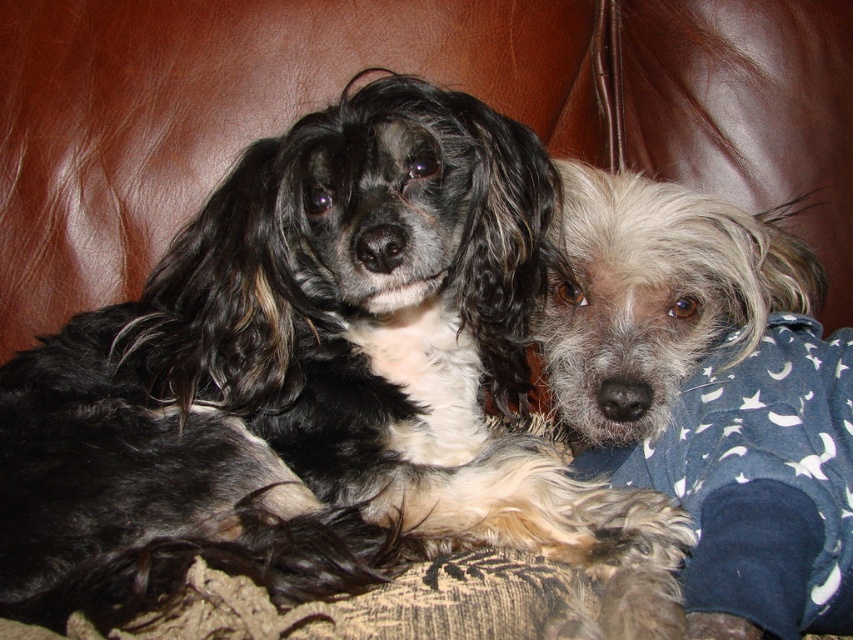
Is black silky fur dog at center bigger than gray fluffy dog at center?

Correct, black silky fur dog at center is larger in size than gray fluffy dog at center.

Is black silky fur dog at center taller than gray fluffy dog at center?

Yes.

The height and width of the screenshot is (640, 853). I want to click on black silky fur dog at center, so click(320, 387).